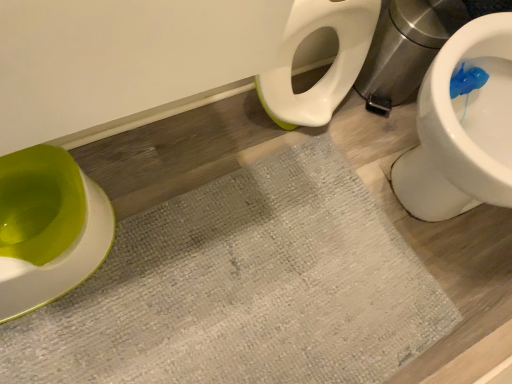
Question: Should I look upward or downward to see textured gray bath mat at center?

Choices:
 (A) up
 (B) down

Answer: (B)

Question: Does textured gray bath mat at center turn towards green plastic toilet at left?

Choices:
 (A) no
 (B) yes

Answer: (A)

Question: Considering the relative sizes of textured gray bath mat at center and green plastic toilet at left in the image provided, is textured gray bath mat at center shorter than green plastic toilet at left?

Choices:
 (A) yes
 (B) no

Answer: (A)

Question: Is textured gray bath mat at center located outside green plastic toilet at left?

Choices:
 (A) no
 (B) yes

Answer: (B)

Question: Considering the relative sizes of textured gray bath mat at center and green plastic toilet at left in the image provided, is textured gray bath mat at center wider than green plastic toilet at left?

Choices:
 (A) yes
 (B) no

Answer: (A)

Question: Would you say textured gray bath mat at center is a long distance from green plastic toilet at left?

Choices:
 (A) no
 (B) yes

Answer: (A)

Question: Is textured gray bath mat at center next to green plastic toilet at left and touching it?

Choices:
 (A) yes
 (B) no

Answer: (B)

Question: Would you say green plastic toilet at left contains textured gray bath mat at center?

Choices:
 (A) no
 (B) yes

Answer: (A)

Question: From the image's perspective, would you say green plastic toilet at left is shown under textured gray bath mat at center?

Choices:
 (A) no
 (B) yes

Answer: (A)

Question: Can you see green plastic toilet at left touching textured gray bath mat at center?

Choices:
 (A) no
 (B) yes

Answer: (A)

Question: Does green plastic toilet at left have a lesser width compared to textured gray bath mat at center?

Choices:
 (A) no
 (B) yes

Answer: (B)

Question: From a real-world perspective, is green plastic toilet at left on top of textured gray bath mat at center?

Choices:
 (A) yes
 (B) no

Answer: (A)

Question: From the image's perspective, is green plastic toilet at left on top of textured gray bath mat at center?

Choices:
 (A) yes
 (B) no

Answer: (A)

Question: Is textured gray bath mat at center spatially inside green plastic toilet at left, or outside of it?

Choices:
 (A) outside
 (B) inside

Answer: (A)